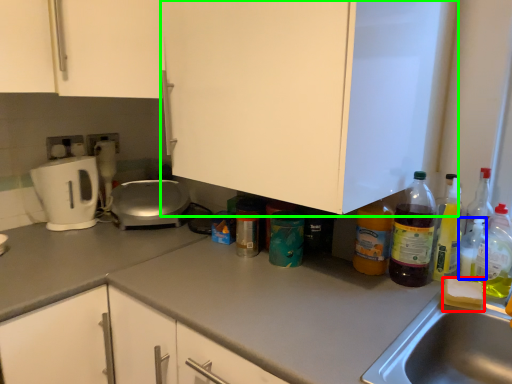
Question: Which object is the closest to the food (highlighted by a red box)? Choose among these: bottle (highlighted by a blue box) or cabinetry (highlighted by a green box).

Choices:
 (A) bottle
 (B) cabinetry

Answer: (A)